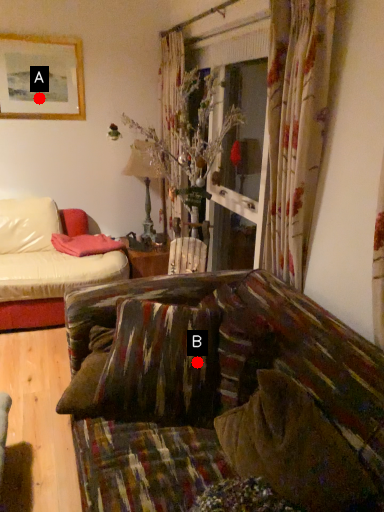
Question: Two points are circled on the image, labeled by A and B beside each circle. Which point is farther to the camera?

Choices:
 (A) A is further
 (B) B is further

Answer: (A)